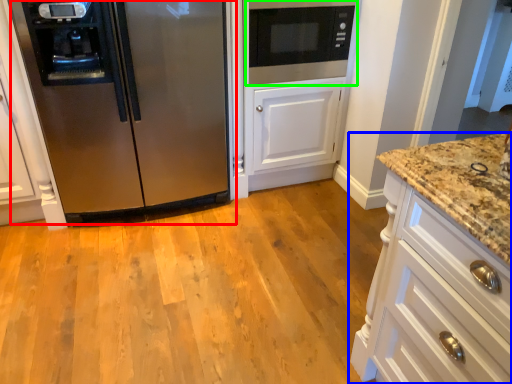
Question: Based on their relative distances, which object is nearer to refrigerator (highlighted by a red box)? Choose from cabinetry (highlighted by a blue box) and microwave oven (highlighted by a green box).

Choices:
 (A) cabinetry
 (B) microwave oven

Answer: (B)